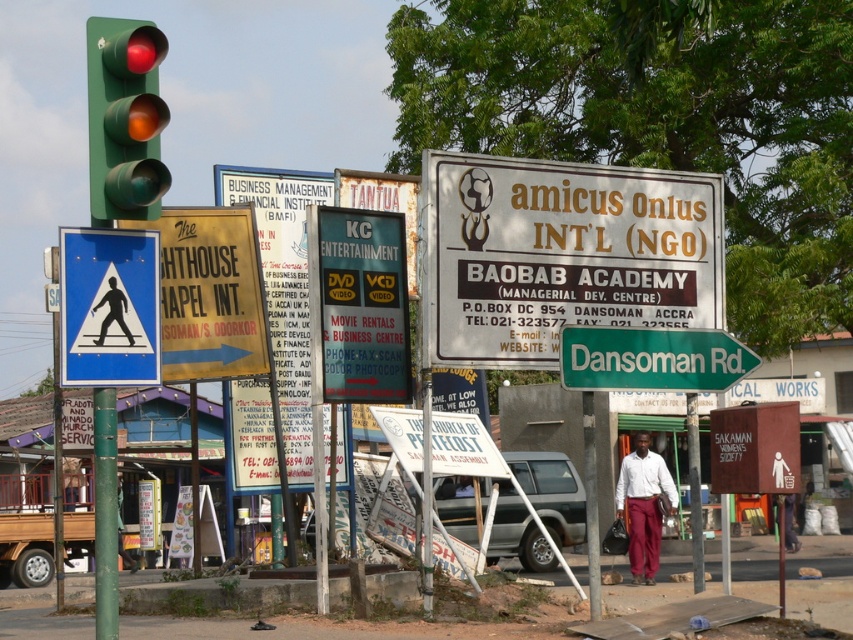
From the picture: Is matte black signboard at center shorter than green metallic signpost at right?

Incorrect, matte black signboard at center's height does not fall short of green metallic signpost at right's.

Where is `matte black signboard at center`? Image resolution: width=853 pixels, height=640 pixels. matte black signboard at center is located at coordinates (363, 307).

Is white paper sign at center positioned at the back of green metallic signpost at right?

Yes, white paper sign at center is behind green metallic signpost at right.

Between white paper sign at center and green metallic signpost at right, which one appears on the left side from the viewer's perspective?

Positioned to the left is white paper sign at center.

Image resolution: width=853 pixels, height=640 pixels. I want to click on white paper sign at center, so click(560, 253).

Identify the location of white paper sign at center. The image size is (853, 640). (560, 253).

Between point (125, 269) and point (573, 330), which one is positioned in front?

Positioned in front is point (125, 269).

Is blue plastic pedestrian crossing sign at left to the left of green metallic signpost at right from the viewer's perspective?

Correct, you'll find blue plastic pedestrian crossing sign at left to the left of green metallic signpost at right.

At what (x,y) coordinates should I click in order to perform the action: click on blue plastic pedestrian crossing sign at left. Please return your answer as a coordinate pair (x, y). The width and height of the screenshot is (853, 640). Looking at the image, I should click on (109, 307).

Identify the location of blue plastic pedestrian crossing sign at left. (109, 307).